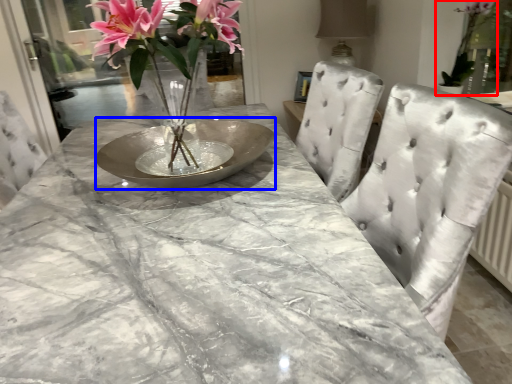
Question: Which point is further to the camera, houseplant (highlighted by a red box) or glass plate (highlighted by a blue box)?

Choices:
 (A) houseplant
 (B) glass plate

Answer: (A)